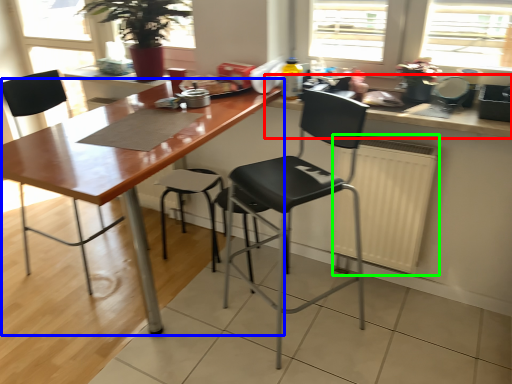
Question: Which object is the closest to the countertop (highlighted by a red box)? Choose among these: table (highlighted by a blue box) or radiator (highlighted by a green box).

Choices:
 (A) table
 (B) radiator

Answer: (B)